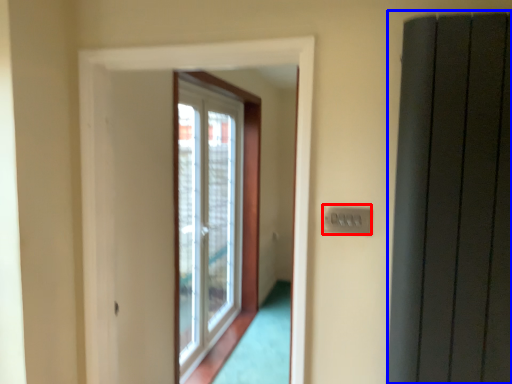
Question: Which of the following is the farthest to the observer, electric outlet (highlighted by a red box) or elevator (highlighted by a blue box)?

Choices:
 (A) electric outlet
 (B) elevator

Answer: (A)